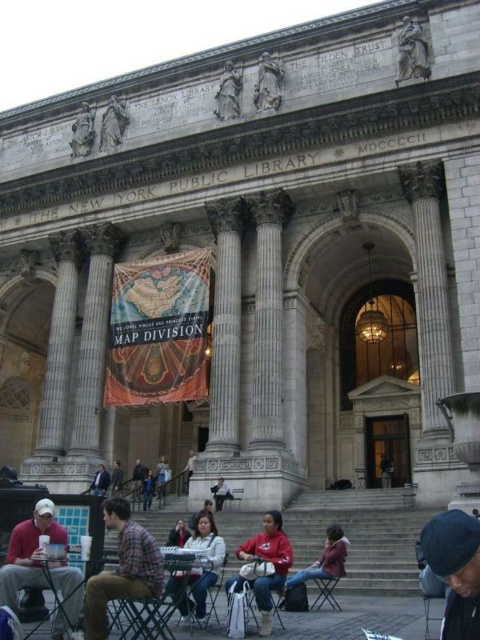
Is white marble pillar at center to the right of metallic folding chair at lower center from the viewer's perspective?

In fact, white marble pillar at center is to the left of metallic folding chair at lower center.

Who is lower down, white marble pillar at center or metallic folding chair at lower center?

Positioned lower is metallic folding chair at lower center.

You are a GUI agent. You are given a task and a screenshot of the screen. Output one action in this format:
    pyautogui.click(x=<x>, y=<y>)
    Task: Click on the white marble pillar at center
    The width and height of the screenshot is (480, 640).
    Given the screenshot: What is the action you would take?
    pyautogui.click(x=226, y=326)

Between white marble pillar at center and metallic silver chair at lower center, which one appears on the right side from the viewer's perspective?

Positioned to the right is metallic silver chair at lower center.

Which is above, white marble pillar at center or metallic silver chair at lower center?

white marble pillar at center is above.

Between point (208, 390) and point (263, 636), which one is positioned in front?

Positioned in front is point (263, 636).

The width and height of the screenshot is (480, 640). Find the location of `white marble pillar at center`. white marble pillar at center is located at coordinates (226, 326).

Is stone statue at upper center shorter than wooden chair at center?

No, stone statue at upper center is not shorter than wooden chair at center.

What do you see at coordinates (267, 83) in the screenshot? This screenshot has width=480, height=640. I see `stone statue at upper center` at bounding box center [267, 83].

You are a GUI agent. You are given a task and a screenshot of the screen. Output one action in this format:
    pyautogui.click(x=<x>, y=<y>)
    Task: Click on the stone statue at upper center
    
    Given the screenshot: What is the action you would take?
    pyautogui.click(x=267, y=83)